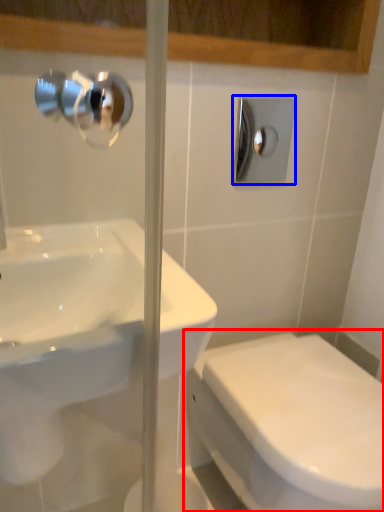
Question: Which point is closer to the camera, toilet (highlighted by a red box) or shower (highlighted by a blue box)?

Choices:
 (A) toilet
 (B) shower

Answer: (A)